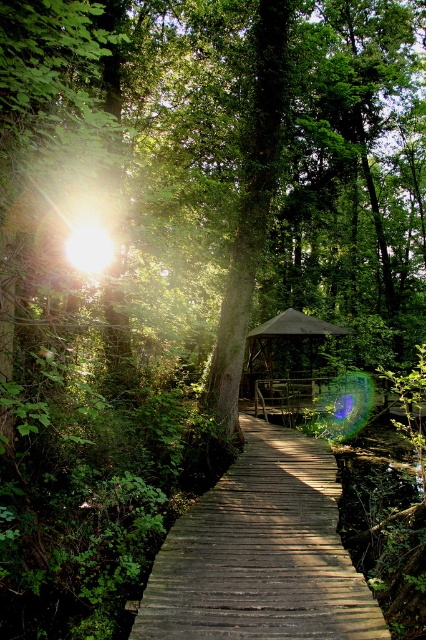
Question: Among these objects, which one is farthest from the camera?

Choices:
 (A) dark gray fabric gazebo at center
 (B) wooden planks at center

Answer: (A)

Question: Can you confirm if wooden planks at center is bigger than dark gray fabric gazebo at center?

Choices:
 (A) no
 (B) yes

Answer: (A)

Question: Which object appears closest to the camera in this image?

Choices:
 (A) wooden planks at center
 (B) dark gray fabric gazebo at center

Answer: (A)

Question: Is wooden planks at center to the left of dark gray fabric gazebo at center from the viewer's perspective?

Choices:
 (A) no
 (B) yes

Answer: (B)

Question: Can you confirm if wooden planks at center is positioned above dark gray fabric gazebo at center?

Choices:
 (A) yes
 (B) no

Answer: (B)

Question: Which object appears farthest from the camera in this image?

Choices:
 (A) wooden planks at center
 (B) dark gray fabric gazebo at center

Answer: (B)